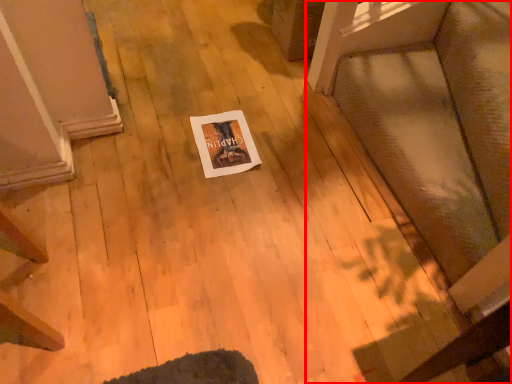
Question: From the image's perspective, what is the correct spatial relationship of furniture (annotated by the red box) in relation to postcard?

Choices:
 (A) above
 (B) below

Answer: (A)